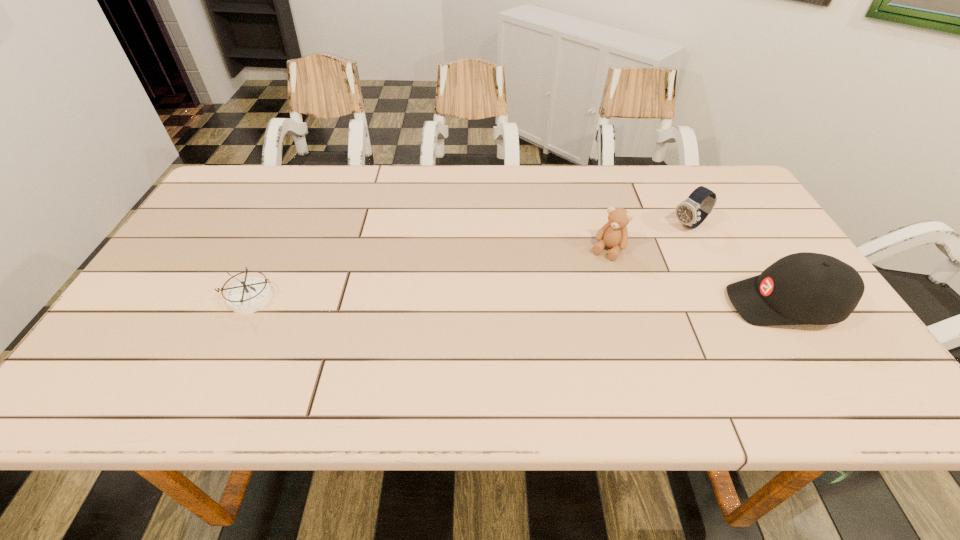
Identify the location of vacant space located 0.290m on the face of the farthest object. Image resolution: width=960 pixels, height=540 pixels. (600, 273).

Find the location of `free region located 0.170m on the face of the farthest object`. free region located 0.170m on the face of the farthest object is located at coordinates (634, 255).

You are a GUI agent. You are given a task and a screenshot of the screen. Output one action in this format:
    pyautogui.click(x=<x>, y=<y>)
    Task: Click on the free space located 0.240m on the face of the farthest object
    
    Given the screenshot: What is the action you would take?
    pyautogui.click(x=614, y=265)

Where is `vacant area located on the front-facing side of the second object from left to right`? vacant area located on the front-facing side of the second object from left to right is located at coordinates (540, 360).

Find the location of a particular element. Image resolution: width=960 pixels, height=540 pixels. vacant region located on the front-facing side of the second object from left to right is located at coordinates (547, 347).

You are a GUI agent. You are given a task and a screenshot of the screen. Output one action in this format:
    pyautogui.click(x=<x>, y=<y>)
    Task: Click on the vacant region located on the front-facing side of the second object from left to right
    
    Given the screenshot: What is the action you would take?
    pyautogui.click(x=589, y=280)

Identify the location of object positioned at the near edge. The height and width of the screenshot is (540, 960). (803, 288).

At what (x,y) coordinates should I click in order to perform the action: click on object positioned at the right edge. Please return your answer as a coordinate pair (x, y). The width and height of the screenshot is (960, 540). Looking at the image, I should click on (803, 288).

The height and width of the screenshot is (540, 960). In order to click on object present at the near right corner in this screenshot , I will do `click(803, 288)`.

Image resolution: width=960 pixels, height=540 pixels. In the image, there is a desktop. Identify the location of vacant space at the far edge. (565, 193).